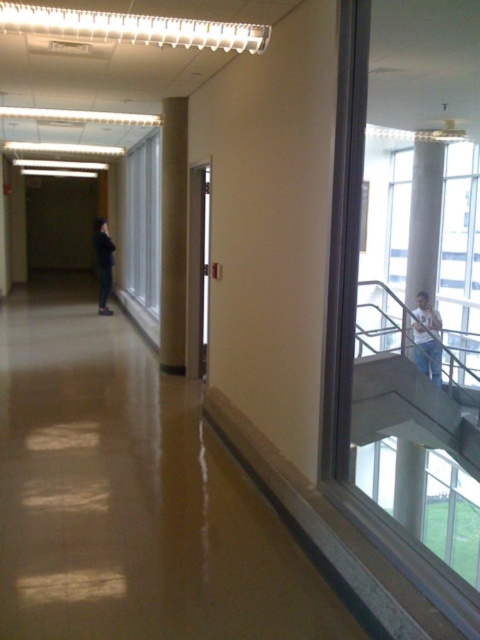
Question: From the image, what is the correct spatial relationship of white cotton shirt at upper right in relation to black matte jacket at left?

Choices:
 (A) right
 (B) left

Answer: (A)

Question: Which point is farther to the camera?

Choices:
 (A) (103, 262)
 (B) (420, 344)

Answer: (A)

Question: Which point is farther from the camera taking this photo?

Choices:
 (A) (98, 296)
 (B) (423, 342)

Answer: (A)

Question: Does white cotton shirt at upper right appear on the left side of black matte jacket at left?

Choices:
 (A) yes
 (B) no

Answer: (B)

Question: Is white cotton shirt at upper right wider than black matte jacket at left?

Choices:
 (A) no
 (B) yes

Answer: (B)